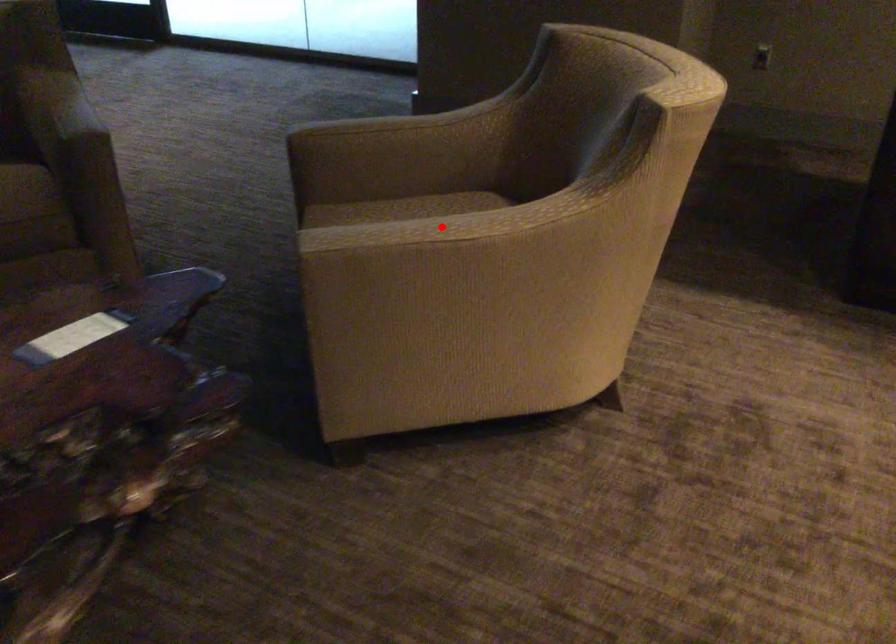
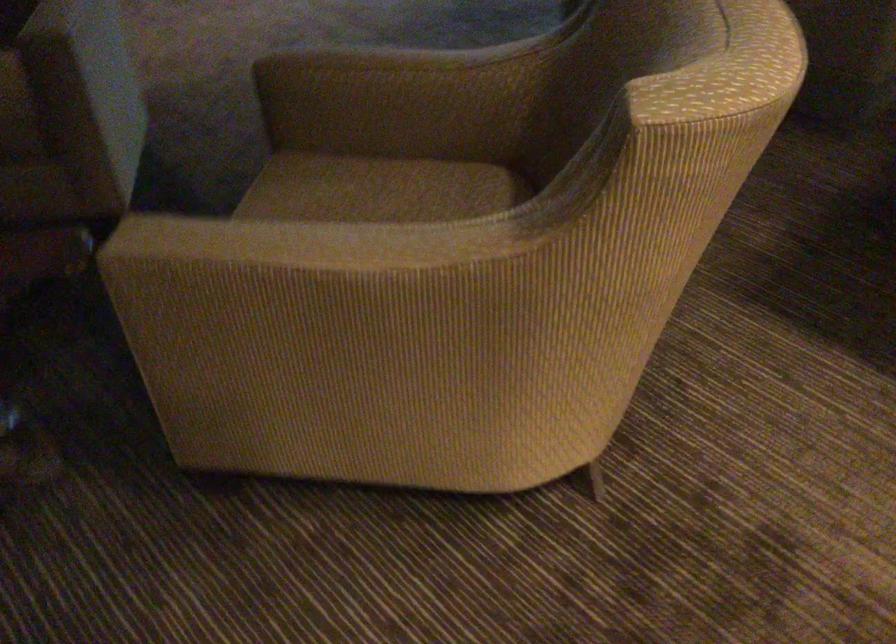
Question: I am providing you with two images of the same scene from different viewpoints. Image1 has a red point marked. In image2, the corresponding 3D location appears at what relative position? Reply with the corresponding letter.

Choices:
 (A) Closer
 (B) Farther

Answer: (A)